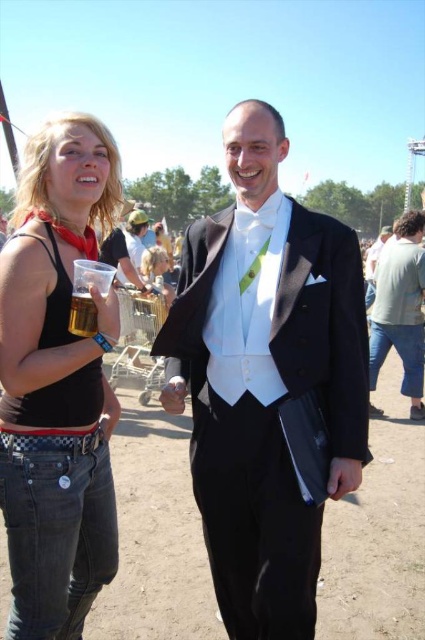
In the scene shown: You are taking a photo of the two people in the scene. You want to focus on the person closer to the camera. Which point should you focus on, point (8, 260) or point (87, 308)?

Point (8, 260) is closer to the camera than point (87, 308), so you should focus on point (8, 260) to capture the person closer to the camera.

You are a photographer at the event and want to capture both the black satin tuxedo at center and the translucent plastic cup at lower left in the same frame. Which object should you focus on first if you want to ensure both are in focus without moving the camera?

The black satin tuxedo at center is wider than the translucent plastic cup at lower left, so focusing on the black satin tuxedo at center first will help ensure both are in focus since it is larger and requires a closer focus point.

You are a photographer at the event and want to capture a photo of the matte black tank top at left and the translucent plastic cup at lower left. The minimum focus distance for your camera is 16 inches. Will you need to adjust your position to ensure both are in focus?

The matte black tank top at left is 15.88 inches from the translucent plastic cup at lower left, which is less than the camera minimum focus distance of 16 inches. Therefore, you will need to move closer to ensure both are in focus.